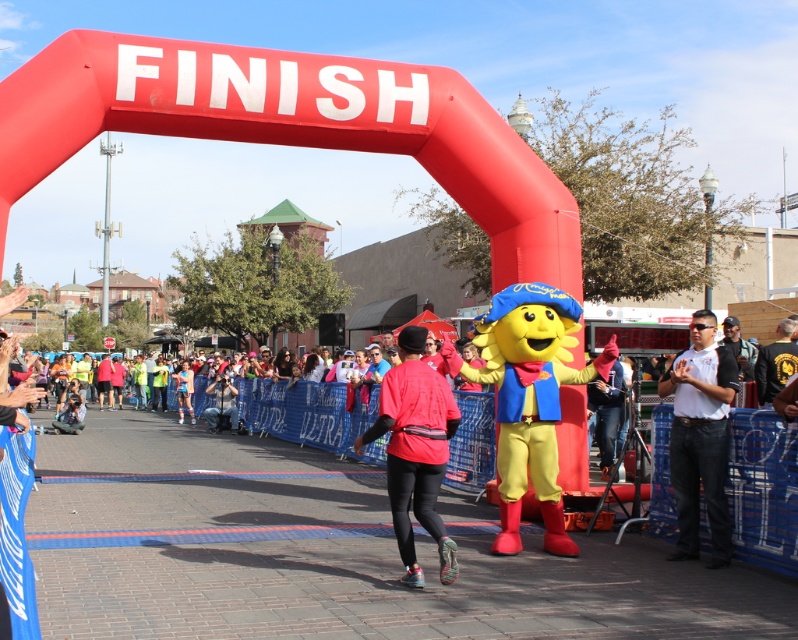
You are a photographer positioned at the finish line. You want to capture a photo that includes both the red matte running outfit at center and the white shirt at center. Given that your camera has a maximum focus range of 2 meters, will you be able to get both subjects in focus?

The red matte running outfit at center and white shirt at center are 2.02 meters apart. Since the distance between them exceeds the camera focus range of 2 meters, the photographer may not be able to get both subjects in focus simultaneously.

You are a photographer at the finish line. You need to take a photo of both the red matte running outfit at center and the white shirt at center. Which one will appear closer to the camera in the photo?

The red matte running outfit at center will appear closer to the camera because it is in front of the white shirt at center.

You are a photographer at the finish line. You want to take a photo of the red matte running outfit at center. Where should you position your camera to capture it in the frame?

The red matte running outfit at center is located at point (415, 451), so you should position your camera at that coordinate to capture it in the frame.